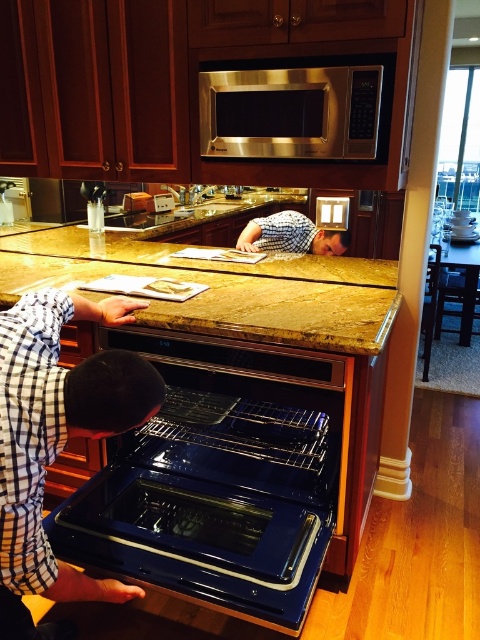
You are a chef preparing to place a dish into the shiny black oven at center and the checkered fabric shirt at center is in your way. Which object should you move to access the oven?

The checkered fabric shirt at center is on the right side of the shiny black oven at center, so you should move the checkered fabric shirt at center to access the oven.

You are standing in the kitchen and see a shiny blue oven at lower center. There is a point marked at coordinates [57,440]. Can you determine if this point is located on the oven?

Yes, the point [57,440] is located on the shiny blue oven at lower center.

You are a kitchen designer planning to place a new appliance between the brown polished granite counter at center and the satin stainless steel microwave at upper center. Based on their positions, which object should the appliance be placed above or below?

The brown polished granite counter at center is below the satin stainless steel microwave at upper center, so the new appliance should be placed above the brown polished granite counter at center and below the satin stainless steel microwave at upper center to maintain the vertical alignment.